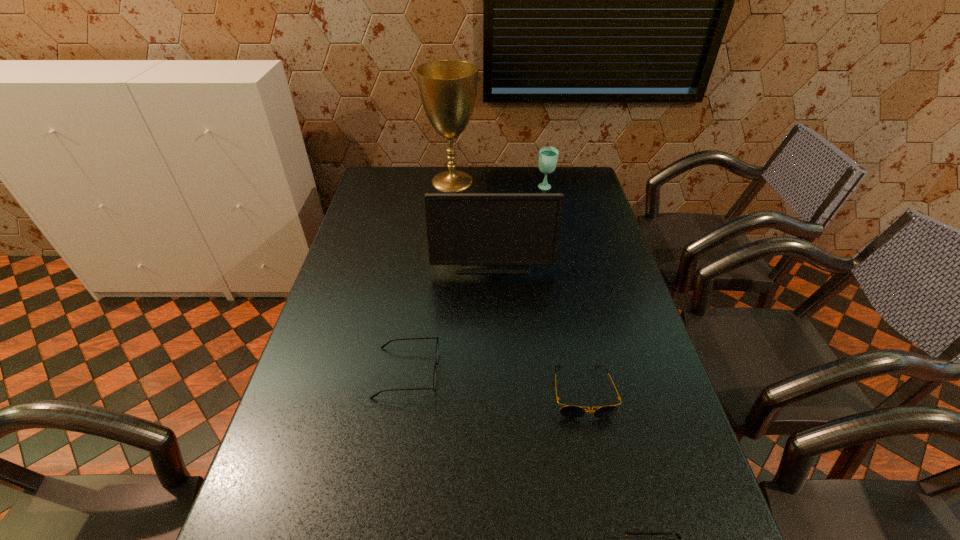
Where is `trophy cup`? This screenshot has height=540, width=960. trophy cup is located at coordinates (448, 88).

This screenshot has height=540, width=960. In order to click on computer monitor in this screenshot , I will do `click(524, 229)`.

Where is `the fifth shortest object`? This screenshot has width=960, height=540. the fifth shortest object is located at coordinates [524, 229].

Identify the location of the third tallest object. This screenshot has height=540, width=960. (548, 156).

Where is `the left spectacles`? The width and height of the screenshot is (960, 540). the left spectacles is located at coordinates (437, 344).

Find the location of a particular element. The width and height of the screenshot is (960, 540). the taller spectacles is located at coordinates (437, 344).

Image resolution: width=960 pixels, height=540 pixels. In order to click on sunglasses in this screenshot , I will do `click(569, 411)`.

You are a GUI agent. You are given a task and a screenshot of the screen. Output one action in this format:
    pyautogui.click(x=<x>, y=<y>)
    Task: Click on the vacant region located on the right of the trophy cup
    
    Given the screenshot: What is the action you would take?
    pyautogui.click(x=575, y=181)

You are a GUI agent. You are given a task and a screenshot of the screen. Output one action in this format:
    pyautogui.click(x=<x>, y=<y>)
    Task: Click on the vacant space situated on the screen side of the fifth shortest object
    The width and height of the screenshot is (960, 540).
    Given the screenshot: What is the action you would take?
    pyautogui.click(x=494, y=325)

Find the location of a particular element. The image size is (960, 540). vacant area situated 0.150m on the left of the third tallest object is located at coordinates (499, 188).